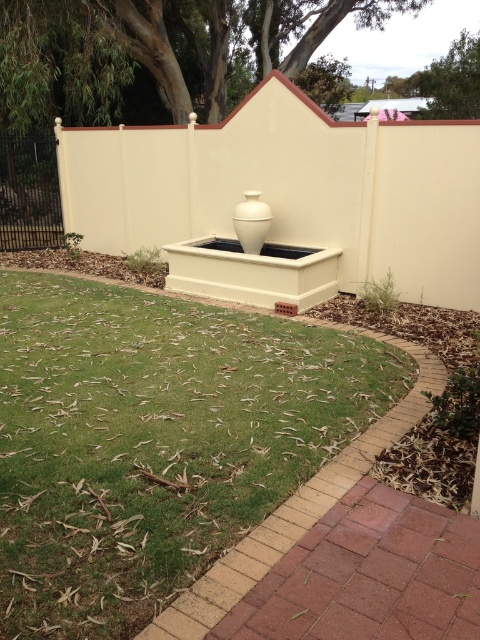
Question: Is brick at lower right closer to camera compared to white glossy vase at center?

Choices:
 (A) yes
 (B) no

Answer: (A)

Question: Which object is farther from the camera taking this photo?

Choices:
 (A) black metal fence at left
 (B) white glossy vase at center
 (C) brick at lower right

Answer: (A)

Question: Does black metal fence at left come behind white glossy vase at center?

Choices:
 (A) yes
 (B) no

Answer: (A)

Question: Which object is positioned farthest from the black metal fence at left?

Choices:
 (A) brick at lower right
 (B) white glossy vase at center

Answer: (A)

Question: Is black metal fence at left thinner than white glossy vase at center?

Choices:
 (A) no
 (B) yes

Answer: (A)

Question: Which of these objects is positioned closest to the white glossy vase at center?

Choices:
 (A) brick at lower right
 (B) black metal fence at left

Answer: (A)